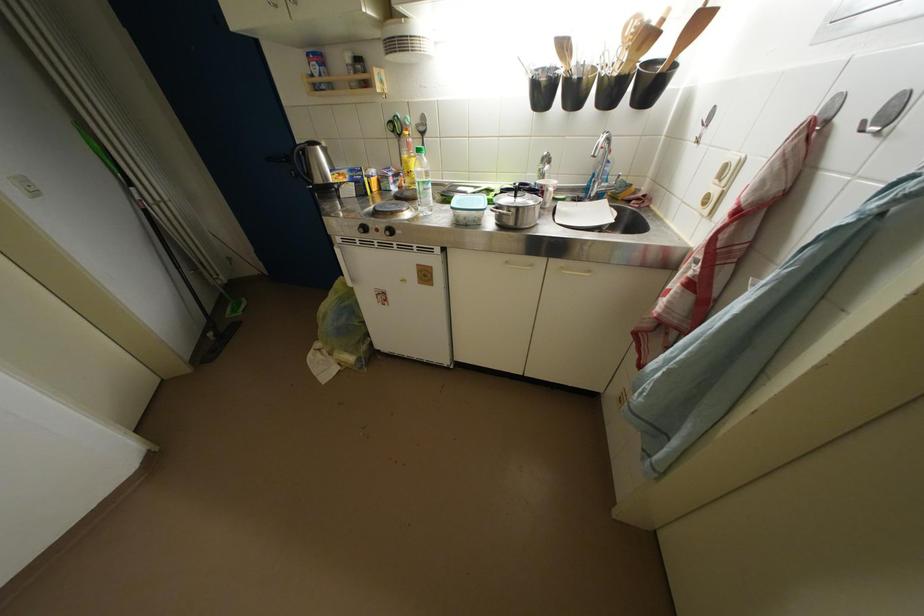
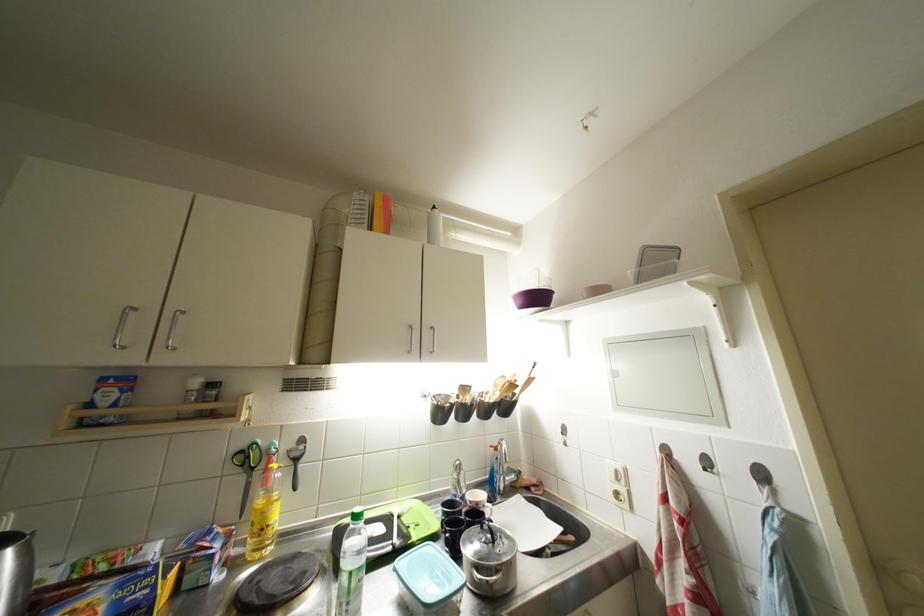
In the second image, find the point that corresponds to [549,191] in the first image.

(483, 508)